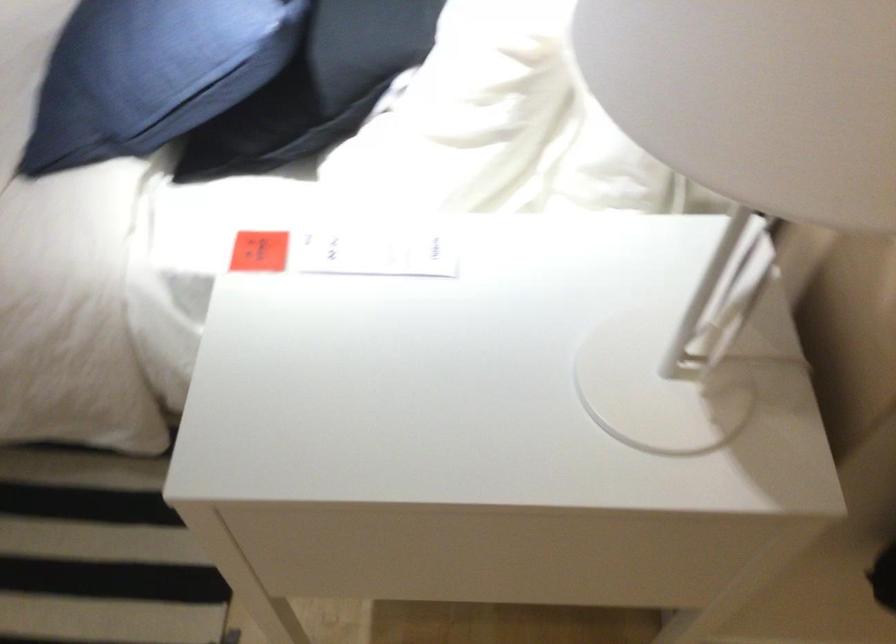
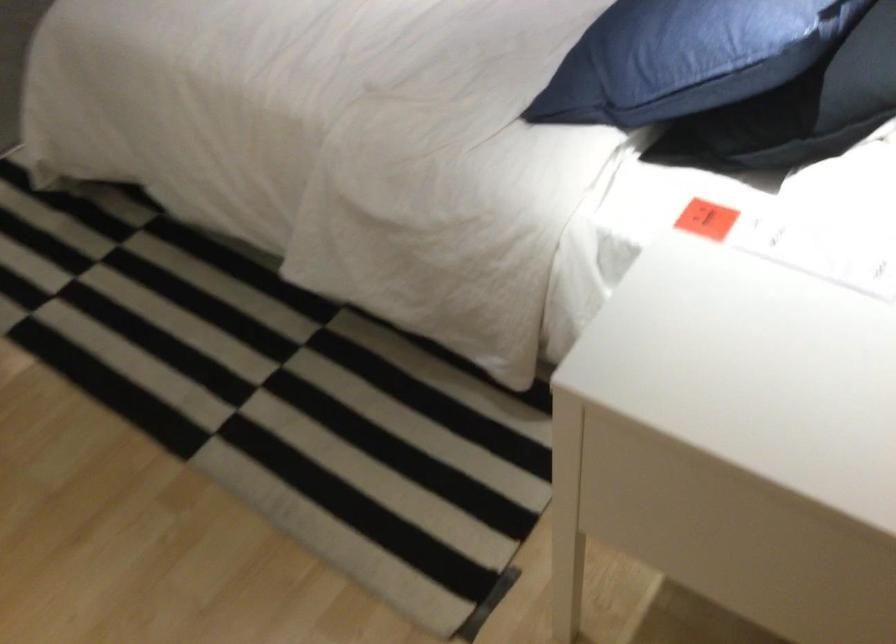
Find the pixel in the second image that matches point (315, 96) in the first image.

(808, 108)